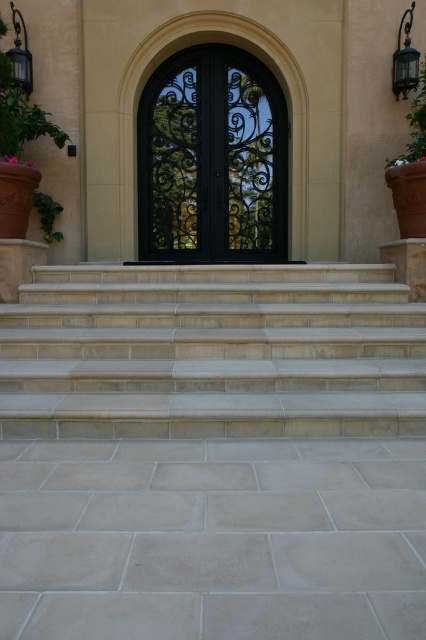
You are standing at the entrance of the building and want to determine the spatial relationship between two points marked on the ground. The first point is located at coordinates point (400, 157) and the second at point (48, 211). Which point is closer to you as you face the entrance?

Point (400, 157) is in front of point (48, 211), so the first point is closer to you as you face the entrance.

You are a delivery person approaching the entrance of the building. You need to deliver a package to the office behind the black wrought iron door at center. However, there is a green leafy plant at upper right in your way. Can you walk around it to reach the door?

The green leafy plant at upper right is behind the black wrought iron door at center, so it is not blocking your path. You can approach the door directly without needing to go around the plant.

You are standing at the entrance of the building and want to determine which of the two points, point (229, 100) or point (423, 96), is closer to you. Based on the scene description, which point is nearer?

Point (229, 100) is further to the viewer than point (423, 96). Wait, no, the description says the opposite. Let me check again. The Objects Description states that point (229, 100) is further to the viewer than point (423, 96). Wait, so actually, point (423, 96) is closer to the viewer. Hmm, the question asks which is closer. So the answer should be point (423, 96) is closer because the other point is further away. But the description says point A is further than point B, so point B is near